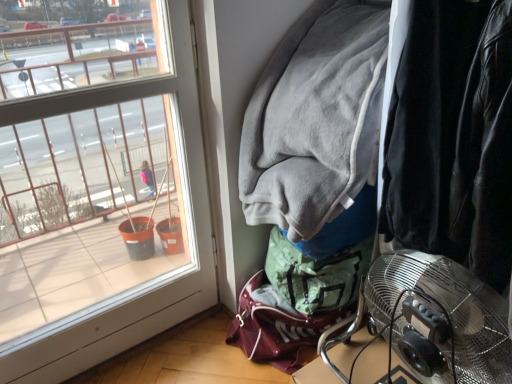
Question: Considering the relative sizes of clear glass window at left and velvet black jacket at right in the image provided, is clear glass window at left shorter than velvet black jacket at right?

Choices:
 (A) yes
 (B) no

Answer: (B)

Question: Can you confirm if clear glass window at left is positioned to the right of velvet black jacket at right?

Choices:
 (A) no
 (B) yes

Answer: (A)

Question: From the image's perspective, does clear glass window at left appear higher than velvet black jacket at right?

Choices:
 (A) no
 (B) yes

Answer: (A)

Question: From the image's perspective, is clear glass window at left below velvet black jacket at right?

Choices:
 (A) no
 (B) yes

Answer: (B)

Question: Would you consider clear glass window at left to be distant from velvet black jacket at right?

Choices:
 (A) no
 (B) yes

Answer: (A)

Question: Could you tell me if clear glass window at left is turned towards velvet black jacket at right?

Choices:
 (A) yes
 (B) no

Answer: (B)

Question: Can you confirm if gray fleece jacket at upper right is thinner than metallic silver fan at lower right?

Choices:
 (A) yes
 (B) no

Answer: (B)

Question: Does gray fleece jacket at upper right have a lesser height compared to metallic silver fan at lower right?

Choices:
 (A) no
 (B) yes

Answer: (B)

Question: Is gray fleece jacket at upper right bigger than metallic silver fan at lower right?

Choices:
 (A) no
 (B) yes

Answer: (B)

Question: From the image's perspective, is gray fleece jacket at upper right located above metallic silver fan at lower right?

Choices:
 (A) no
 (B) yes

Answer: (B)

Question: Does gray fleece jacket at upper right appear on the left side of metallic silver fan at lower right?

Choices:
 (A) yes
 (B) no

Answer: (A)

Question: Considering the relative positions of gray fleece jacket at upper right and metallic silver fan at lower right in the image provided, is gray fleece jacket at upper right to the right of metallic silver fan at lower right from the viewer's perspective?

Choices:
 (A) yes
 (B) no

Answer: (B)

Question: Does clear glass window at left appear on the left side of metallic silver fan at lower right?

Choices:
 (A) no
 (B) yes

Answer: (B)